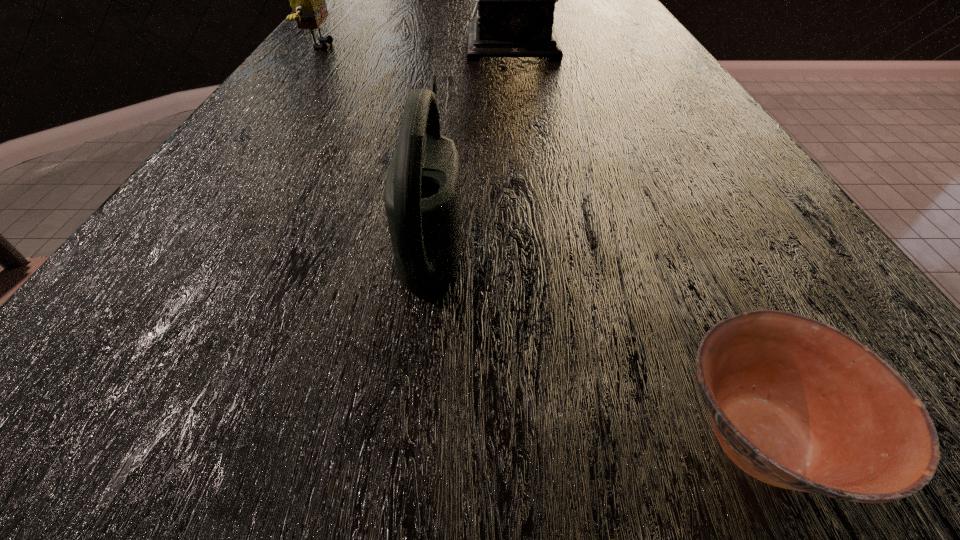
At what (x,y) coordinates should I click in order to perform the action: click on free space in the image that satisfies the following two spatial constraints: 1. on the horn of the record player; 2. on the spout of the third farthest object. Please return your answer as a coordinate pair (x, y). Looking at the image, I should click on (559, 232).

What are the coordinates of `free location that satisfies the following two spatial constraints: 1. on the horn of the tallest object; 2. on the right side of the nearest object` in the screenshot? It's located at (598, 438).

I want to click on free space that satisfies the following two spatial constraints: 1. on the face of the sponge; 2. on the back side of the bowl, so click(49, 438).

The height and width of the screenshot is (540, 960). What are the coordinates of `free spot that satisfies the following two spatial constraints: 1. on the horn of the tallest object; 2. on the face of the leftmost object` in the screenshot? It's located at (523, 46).

Locate an element on the screen. vacant space that satisfies the following two spatial constraints: 1. on the spout of the bowl; 2. on the left side of the third farthest object is located at coordinates (409, 438).

Where is `free space that satisfies the following two spatial constraints: 1. on the face of the sponge; 2. on the back side of the nearest object`? free space that satisfies the following two spatial constraints: 1. on the face of the sponge; 2. on the back side of the nearest object is located at coordinates (49, 438).

What are the coordinates of `vacant point that satisfies the following two spatial constraints: 1. on the horn of the bowl; 2. on the right side of the tallest object` in the screenshot? It's located at (598, 438).

The height and width of the screenshot is (540, 960). In order to click on free location that satisfies the following two spatial constraints: 1. on the horn of the record player; 2. on the spout of the third farthest object in this screenshot , I will do `click(559, 232)`.

At what (x,y) coordinates should I click in order to perform the action: click on vacant space that satisfies the following two spatial constraints: 1. on the spout of the second nearest object; 2. on the right side of the shortest object. Please return your answer as a coordinate pair (x, y). Looking at the image, I should click on (409, 438).

The width and height of the screenshot is (960, 540). I want to click on vacant point that satisfies the following two spatial constraints: 1. on the spout of the second nearest object; 2. on the back side of the shortest object, so click(x=409, y=438).